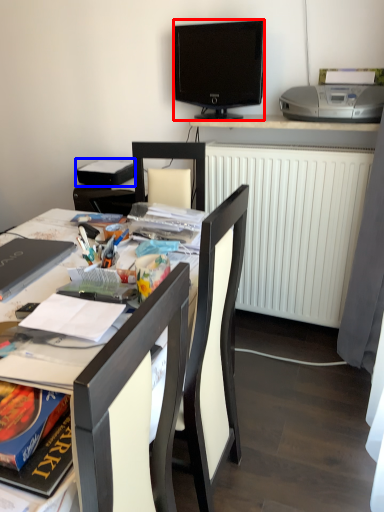
Question: Among these objects, which one is nearest to the camera, television (highlighted by a red box) or book (highlighted by a blue box)?

Choices:
 (A) television
 (B) book

Answer: (A)